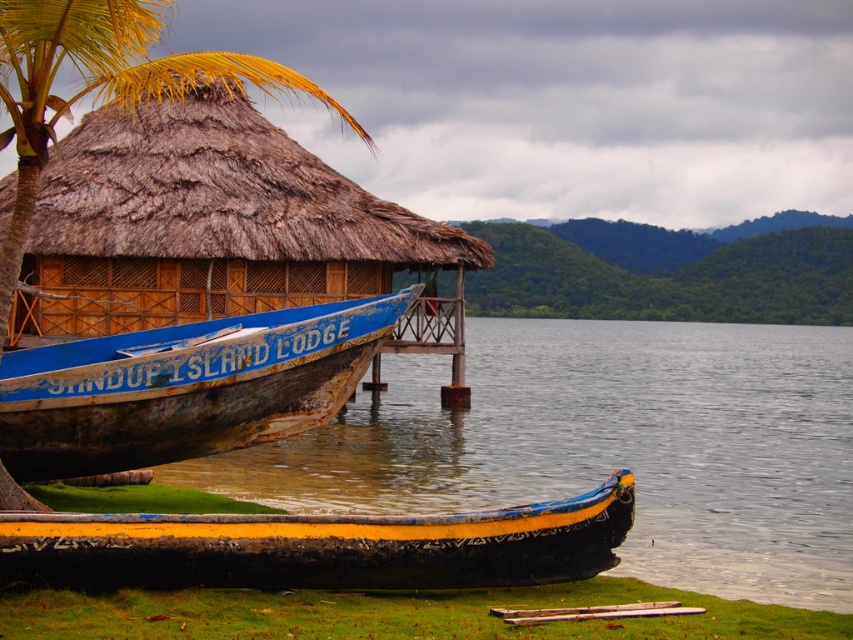
You are a tourist standing at the wooden at lower center and want to take a photo of the brown thatch palm tree at upper left. Which direction should you face to capture it in your shot?

You should face to the left to capture the brown thatch palm tree at upper left in your shot since it is located to the left of the wooden at lower center.

You are standing at the lakeside near the thatched roof hut and want to reach a specific point marked as point (155, 540). If your maximum walking distance is 40 feet, can you reach this point without needing to swim?

The point (155, 540) is 38.27 feet away from the viewer, which is within your 40 feet walking distance limit. Therefore, you can reach it without swimming.

In the scene shown: You are standing at the lakeside and want to take a photo of the brown thatch palm tree at upper left. If your camera can focus on objects up to 10 meters away, will you be able to capture a clear photo of the tree?

The brown thatch palm tree at upper left is 12.62 meters away from the viewer, which exceeds the camera focus limit of 10 meters. Therefore, you won